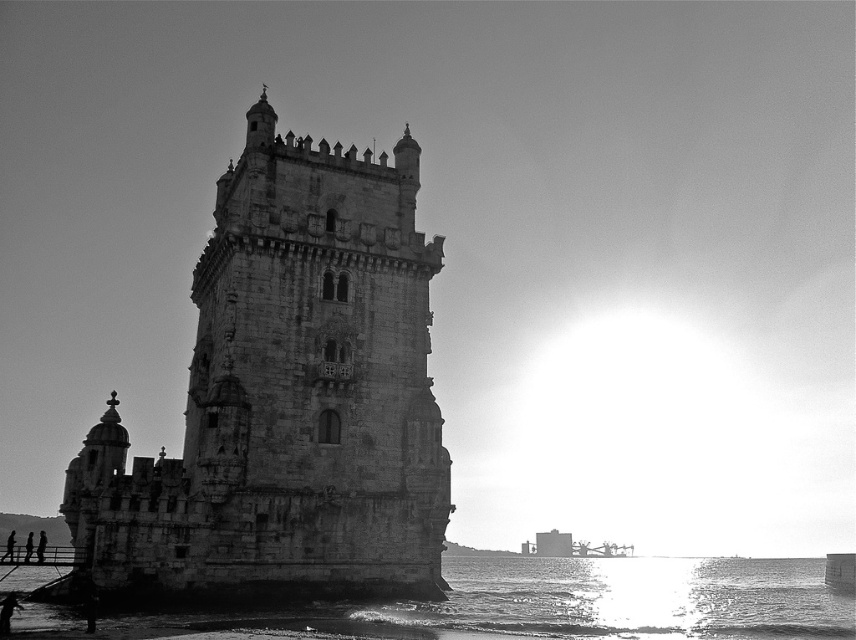
You are a photographer planning to capture the stone tower at center and the reflective silver water at lower center in a single shot. Based on the scene, which object occupies a larger area in the image?

The reflective silver water at lower center occupies a larger area in the image than the stone tower at center, as stated in the description.

You are a tourist standing in front of the Torre de Belm and want to take a photo that includes both the stone tower at center and the reflective silver water at lower center. Based on their positions, which object should appear closer to the camera in your photo?

The stone tower at center is further to the viewer than reflective silver water at lower center, so the stone tower at center will appear closer to the camera in the photo.